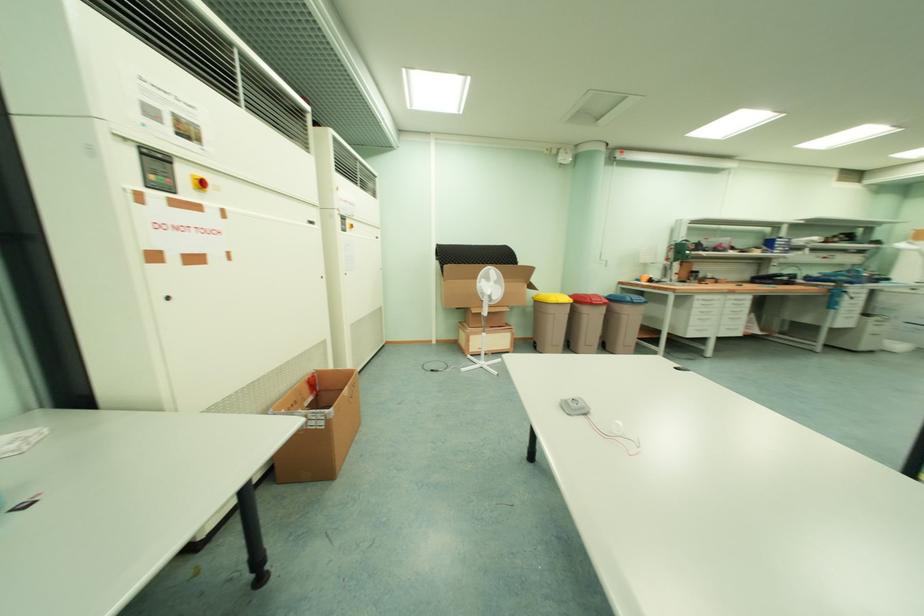
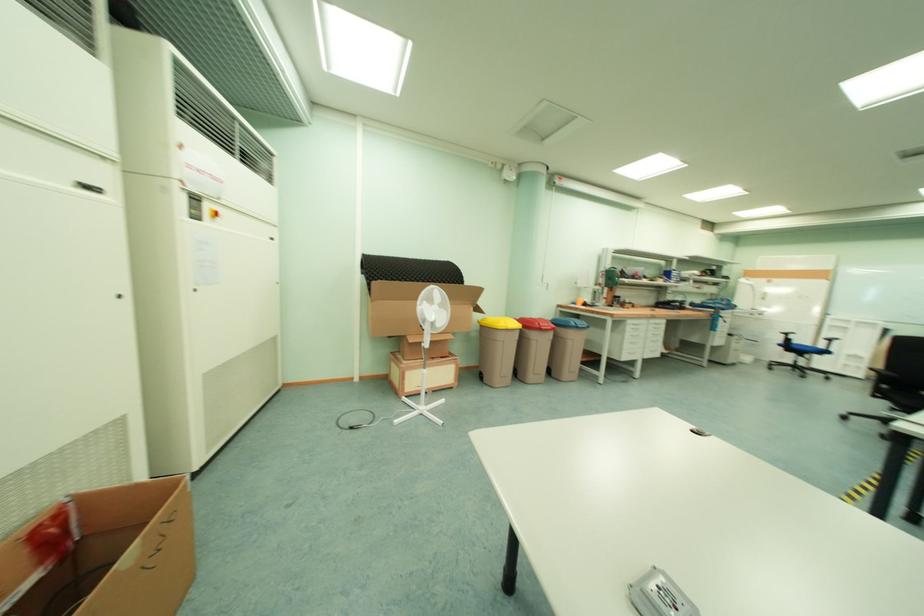
Question: The camera is either moving clockwise (left) or counter-clockwise (right) around the object. The first image is from the beginning of the video and the second image is from the end. Is the camera moving left or right when shooting the video?

Choices:
 (A) Left
 (B) Right

Answer: (A)